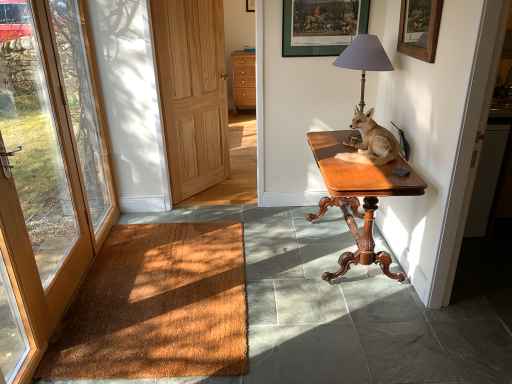
Find the location of `spots to the right of brown coir mat at lower left`. spots to the right of brown coir mat at lower left is located at coordinates (321, 302).